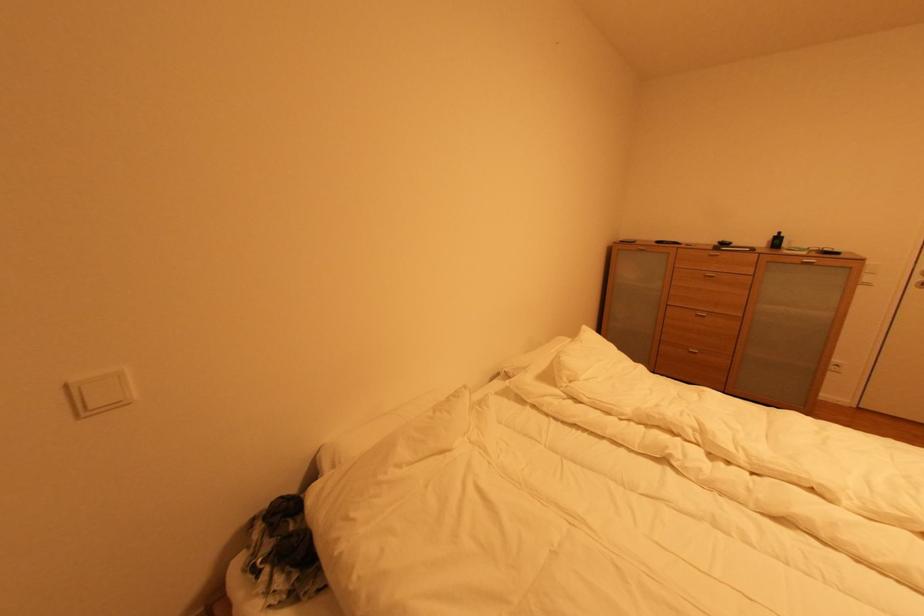
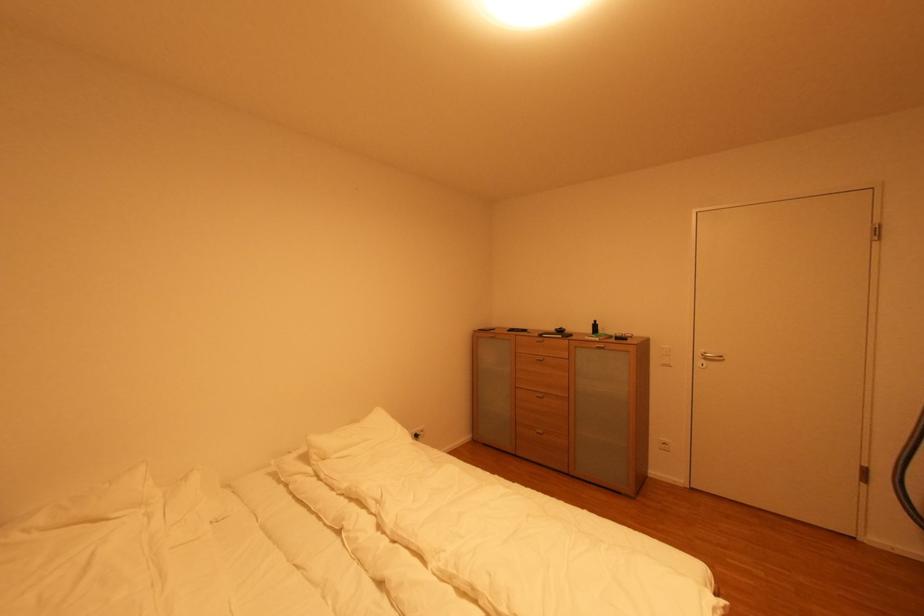
In the second image, find the point that corresponds to point 873,285 in the first image.

(670, 367)